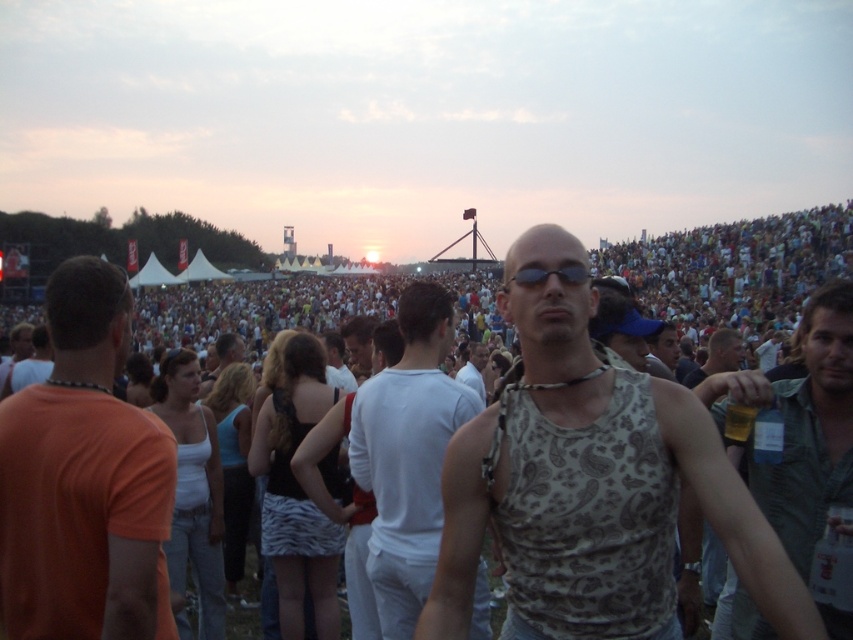
Between orange t-shirt at left and green textured shirt at center, which one is positioned higher?

orange t-shirt at left

Identify the location of orange t-shirt at left. The height and width of the screenshot is (640, 853). tap(84, 480).

Who is lower down, printed cotton tank top at center or patterned tank top at center?

printed cotton tank top at center is below.

Does point (553, 307) come in front of point (260, 337)?

Yes, it is.

You are a GUI agent. You are given a task and a screenshot of the screen. Output one action in this format:
    pyautogui.click(x=<x>, y=<y>)
    Task: Click on the printed cotton tank top at center
    The height and width of the screenshot is (640, 853).
    Given the screenshot: What is the action you would take?
    pyautogui.click(x=589, y=481)

The image size is (853, 640). Describe the element at coordinates (718, 356) in the screenshot. I see `light brown hair at center` at that location.

Which is more to the right, light brown hair at center or white tank top at center?

From the viewer's perspective, light brown hair at center appears more on the right side.

The image size is (853, 640). What are the coordinates of `light brown hair at center` in the screenshot? It's located at (718, 356).

Where is `light brown hair at center`? The image size is (853, 640). light brown hair at center is located at coordinates (718, 356).